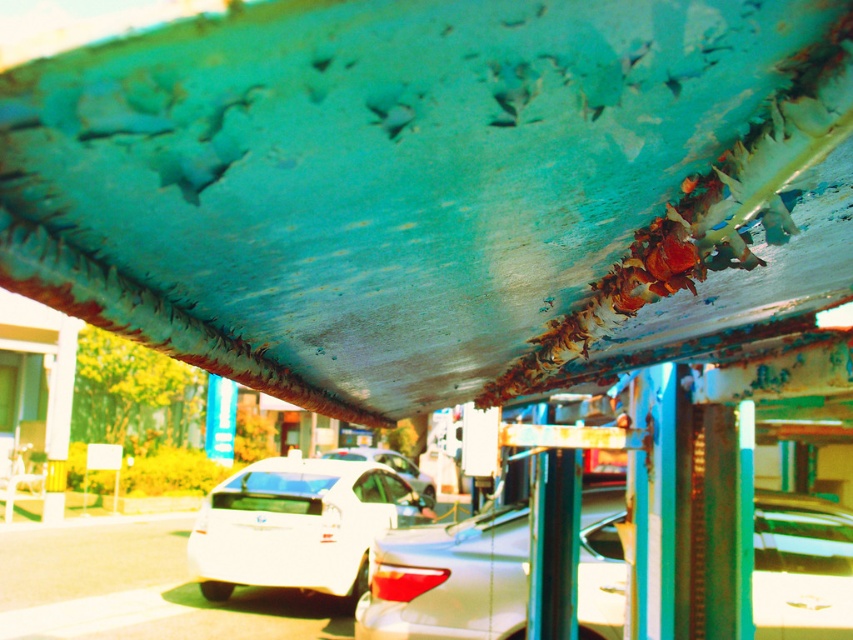
Question: Can you confirm if white matte car at center is wider than shiny white car at center?

Choices:
 (A) yes
 (B) no

Answer: (B)

Question: Is satin white sedan at center positioned at the back of shiny white car at center?

Choices:
 (A) yes
 (B) no

Answer: (B)

Question: Which is nearer to the white matte car at center?

Choices:
 (A) satin white sedan at center
 (B) shiny white car at center

Answer: (A)

Question: Can you confirm if satin white sedan at center is positioned to the right of white matte car at center?

Choices:
 (A) yes
 (B) no

Answer: (A)

Question: Among these objects, which one is farthest from the camera?

Choices:
 (A) satin white sedan at center
 (B) shiny white car at center
 (C) white matte car at center

Answer: (B)

Question: Which point is farther to the camera?

Choices:
 (A) white matte car at center
 (B) satin white sedan at center

Answer: (A)